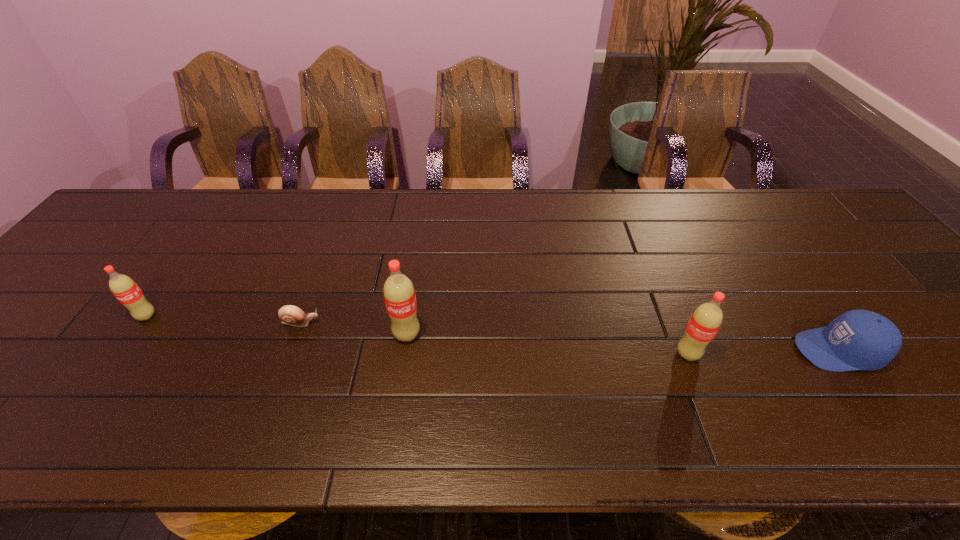
Image resolution: width=960 pixels, height=540 pixels. What are the coordinates of `vacant region at the right edge` in the screenshot? It's located at (940, 316).

At what (x,y) coordinates should I click in order to perform the action: click on free space at the far left corner. Please return your answer as a coordinate pair (x, y). The height and width of the screenshot is (540, 960). Looking at the image, I should click on (145, 205).

You are a GUI agent. You are given a task and a screenshot of the screen. Output one action in this format:
    pyautogui.click(x=<x>, y=<y>)
    Task: Click on the free spot between the third tallest object and the second soda from right to left
    This screenshot has width=960, height=540.
    Given the screenshot: What is the action you would take?
    pyautogui.click(x=276, y=325)

The image size is (960, 540). Find the location of `vacant space in between the rightmost object and the shortest soda`. vacant space in between the rightmost object and the shortest soda is located at coordinates (492, 333).

Where is `free spot between the third object from right to left and the leftmost object`? Image resolution: width=960 pixels, height=540 pixels. free spot between the third object from right to left and the leftmost object is located at coordinates (276, 325).

Find the location of a particular element. This screenshot has width=960, height=540. vacant area between the third object from right to left and the fourth shortest object is located at coordinates (547, 344).

The height and width of the screenshot is (540, 960). Identify the location of free space between the cap and the fourth shortest object. (762, 352).

The height and width of the screenshot is (540, 960). In order to click on free space between the shortest object and the second soda from left to right in this screenshot , I will do `click(354, 328)`.

Where is `free spot between the rightmost object and the rightmost soda`? The width and height of the screenshot is (960, 540). free spot between the rightmost object and the rightmost soda is located at coordinates (762, 352).

Image resolution: width=960 pixels, height=540 pixels. In order to click on free area in between the third object from right to left and the fourth tallest object in this screenshot , I will do `click(622, 342)`.